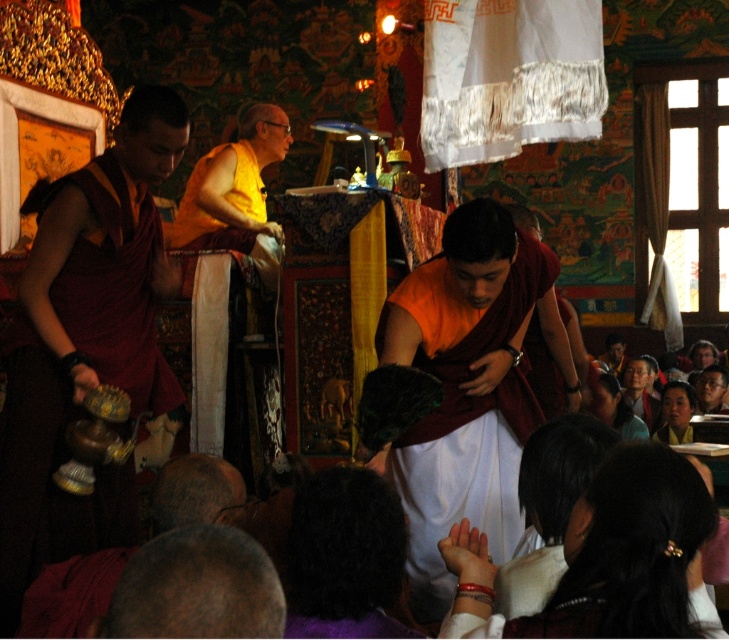
Question: Does orange matte cloth at center have a greater width compared to dark brown leather hat at lower left?

Choices:
 (A) yes
 (B) no

Answer: (A)

Question: Does bald head at lower left come behind dark brown leather hat at lower left?

Choices:
 (A) no
 (B) yes

Answer: (A)

Question: Estimate the real-world distances between objects in this image. Which object is farther from the dark brown leather hat at lower left?

Choices:
 (A) bald head at lower left
 (B) orange matte cloth at center

Answer: (B)

Question: Can you confirm if orange matte cloth at center is positioned to the right of dark brown leather hat at lower left?

Choices:
 (A) yes
 (B) no

Answer: (A)

Question: Which point is closer to the camera?

Choices:
 (A) (467, 230)
 (B) (261, 113)

Answer: (A)

Question: Which point is farther to the camera?

Choices:
 (A) yellow-orange robe at center
 (B) bald head at lower left

Answer: (A)